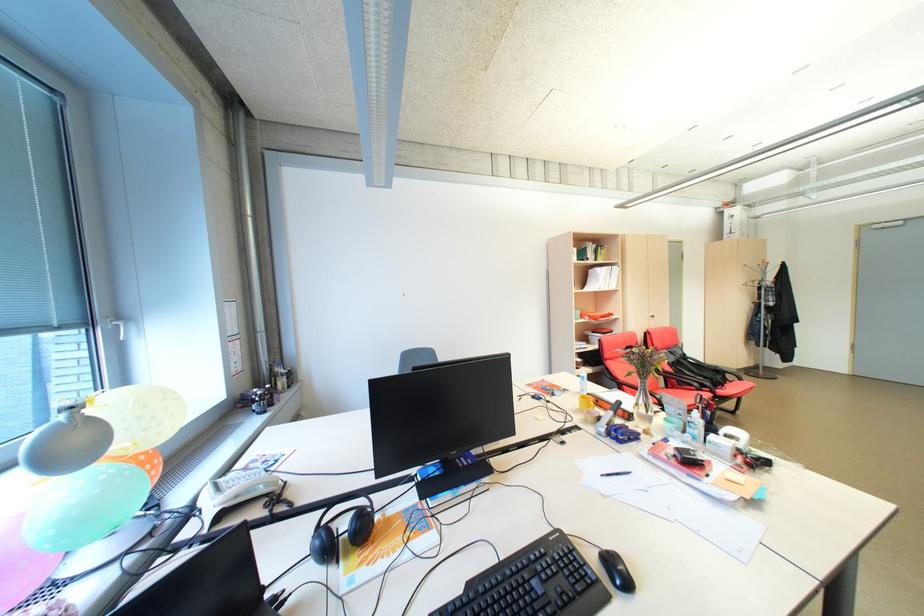
I want to click on black chair armrest, so click(x=663, y=395).